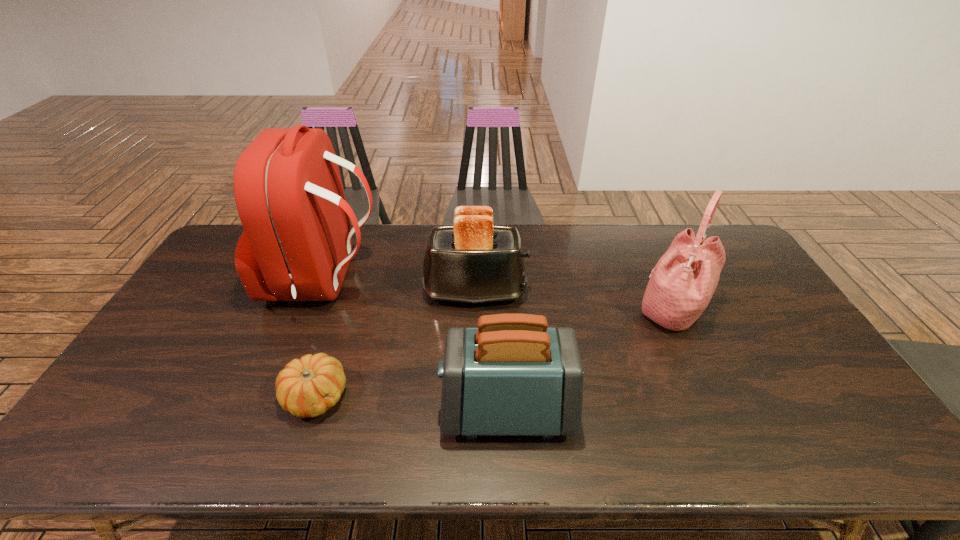
You are a GUI agent. You are given a task and a screenshot of the screen. Output one action in this format:
    pyautogui.click(x=<x>, y=<y>)
    Task: Click on the free point located on the front-facing side of the nearer toaster
    
    Given the screenshot: What is the action you would take?
    pyautogui.click(x=308, y=410)

Where is `vacant space located 0.150m on the front-facing side of the nearer toaster`? vacant space located 0.150m on the front-facing side of the nearer toaster is located at coordinates (381, 410).

Where is `free space located on the back of the gourd`? The image size is (960, 540). free space located on the back of the gourd is located at coordinates (355, 275).

This screenshot has height=540, width=960. Identify the location of object present at the far edge. (296, 245).

Identify the location of toaster that is positioned at the near edge. (512, 375).

I want to click on gourd present at the near edge, so click(307, 387).

Where is `vacant area at the far edge`? vacant area at the far edge is located at coordinates (372, 243).

Where is `vacant space at the near edge`? This screenshot has width=960, height=540. vacant space at the near edge is located at coordinates (726, 446).

The width and height of the screenshot is (960, 540). In order to click on vacant region at the left edge of the desktop in this screenshot , I will do `click(147, 407)`.

In the image, there is a desktop. Find the location of `free region at the near left corner`. free region at the near left corner is located at coordinates (109, 435).